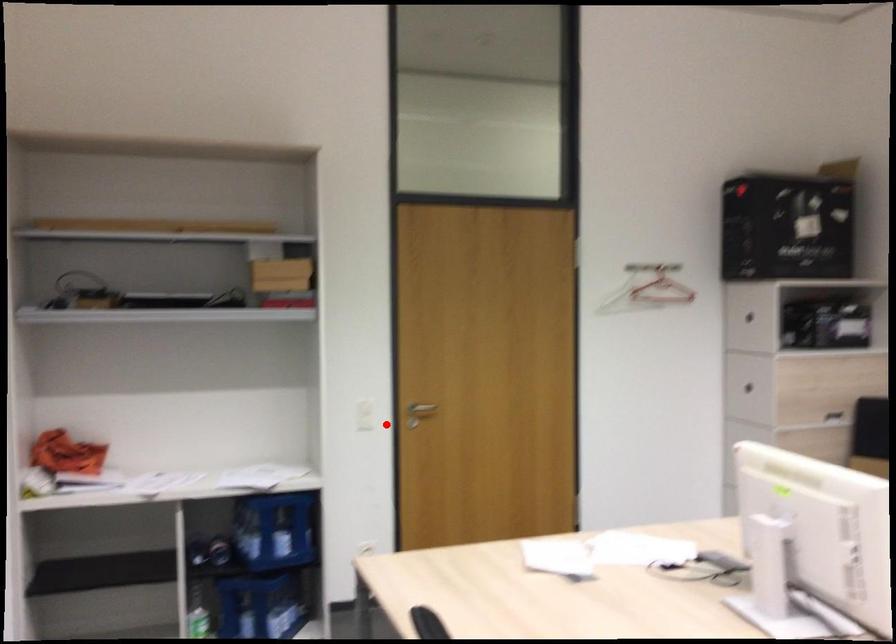
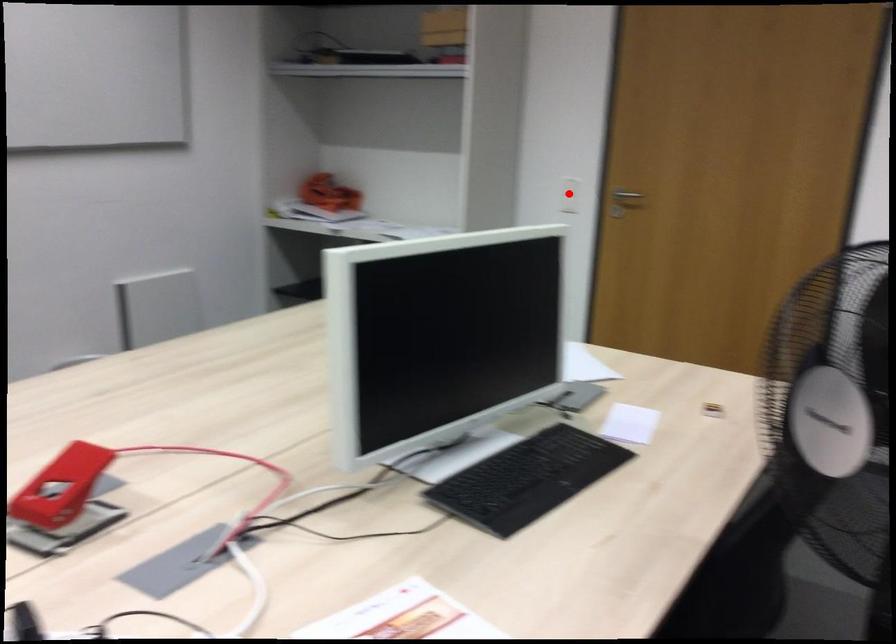
I am providing you with two images of the same scene from different viewpoints. A red point is marked on the first image and another point is marked on the second image. Are the points marked in image1 and image2 representing the same 3D position?

No